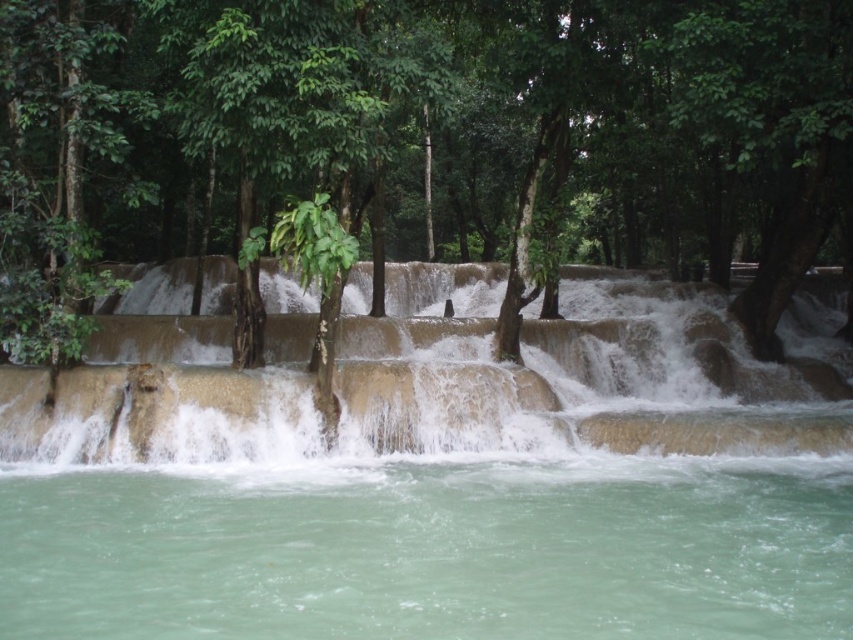
Question: Is clear water at lower center thinner than brown textured waterfall at center?

Choices:
 (A) no
 (B) yes

Answer: (B)

Question: Is the position of clear water at lower center less distant than that of brown textured waterfall at center?

Choices:
 (A) no
 (B) yes

Answer: (B)

Question: Can you confirm if clear water at lower center is positioned below brown textured waterfall at center?

Choices:
 (A) no
 (B) yes

Answer: (B)

Question: Which point is farther from the camera taking this photo?

Choices:
 (A) (50, 596)
 (B) (503, 397)

Answer: (B)

Question: Which object is closer to the camera taking this photo?

Choices:
 (A) clear water at lower center
 (B) brown textured waterfall at center
 (C) green leafy tree at center

Answer: (A)

Question: Considering the real-world distances, which object is farthest from the green leafy tree at center?

Choices:
 (A) clear water at lower center
 (B) brown textured waterfall at center

Answer: (A)